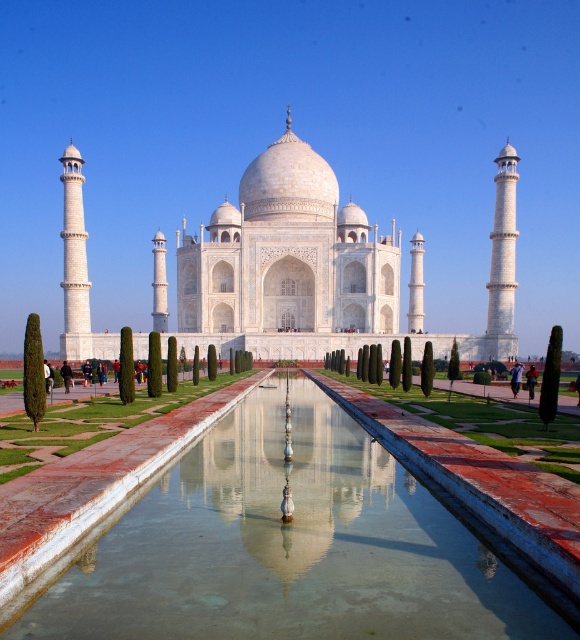
You are a tourist standing in front of the Taj Mahal and want to take a photo that includes both the clear glass water at center and the white marble water at center. Which object should you focus on first if you want to capture both in one shot without moving the camera?

The clear glass water at center is much taller than the white marble water at center, so you should focus on the clear glass water at center first to ensure both are in focus.

You are a photographer planning to capture the Taj Mahal and its surroundings. You want to ensure that both the clear glass water at center and the white marble taj mahal at center are visible in your photo. Based on their sizes in the scene, which object will occupy more of the frame?

The white marble taj mahal at center occupies more space than the clear glass water at center, so it will take up more of the frame.

You are standing at the front of the Taj Mahal and want to take a photo of the clear glass water at center. Based on the coordinates given, where should you position yourself to capture the best reflection of the Taj Mahal?

The clear glass water at center is positioned at coordinates point (288, 545), so you should position yourself directly in front of the Taj Mahal at the center to capture the best reflection since the water is centered and calm.